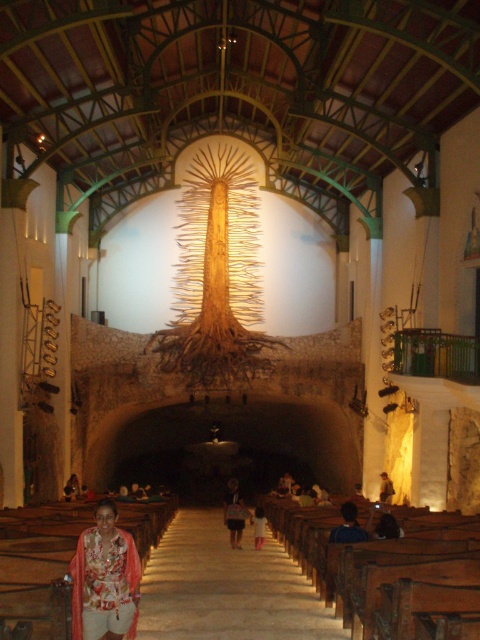
Question: Which point is closer to the camera?

Choices:
 (A) (241, 532)
 (B) (93, 604)

Answer: (B)

Question: Which object is the closest to the denim jacket at center?

Choices:
 (A) light brown leather jacket at lower right
 (B) floral fabric dress at center

Answer: (A)

Question: Is denim jacket at center closer to the viewer compared to light brown leather jacket at lower right?

Choices:
 (A) no
 (B) yes

Answer: (B)

Question: Does denim jacket at center have a greater width compared to pink fabric at center?

Choices:
 (A) no
 (B) yes

Answer: (B)

Question: Among these objects, which one is nearest to the camera?

Choices:
 (A) floral fabric dress at center
 (B) pink fabric at center

Answer: (A)

Question: Does floral fabric dress at center have a smaller size compared to light brown leather jacket at lower right?

Choices:
 (A) no
 (B) yes

Answer: (A)